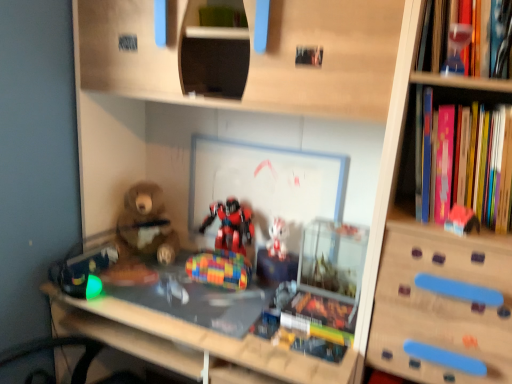
The image size is (512, 384). I want to click on vacant space that is to the left of multicolored plastic cube at center, the fifth toy when ordered from right to left, so click(170, 292).